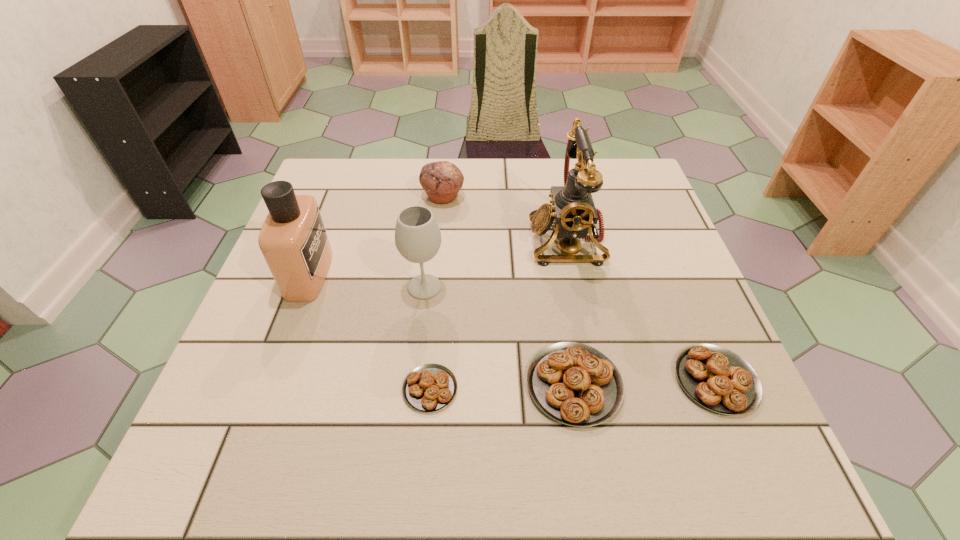
Identify the location of object at the left edge. (293, 240).

This screenshot has height=540, width=960. What are the coordinates of `object that is positioned at the right edge` in the screenshot? It's located at [718, 379].

Identify the location of object located in the near right corner section of the desktop. This screenshot has width=960, height=540. (718, 379).

Where is `vacant space at the far edge`? vacant space at the far edge is located at coordinates (463, 206).

I want to click on vacant space at the near edge of the desktop, so click(x=466, y=405).

Where is `vacant space at the left edge of the desktop`? This screenshot has height=540, width=960. vacant space at the left edge of the desktop is located at coordinates (281, 370).

The height and width of the screenshot is (540, 960). Identify the location of vacant space at the right edge of the desktop. (674, 246).

I want to click on vacant space at the far left corner of the desktop, so click(344, 174).

This screenshot has width=960, height=540. In order to click on blank space at the near left corner of the desktop in this screenshot , I will do `click(265, 423)`.

Locate an element on the screen. This screenshot has width=960, height=540. unoccupied position between the tallest object and the second pastry from right to left is located at coordinates (570, 312).